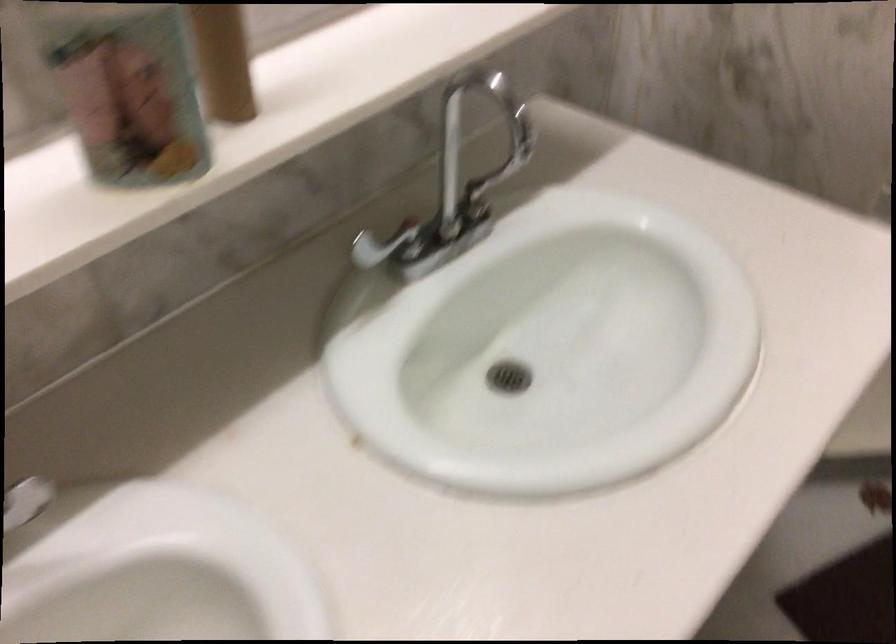
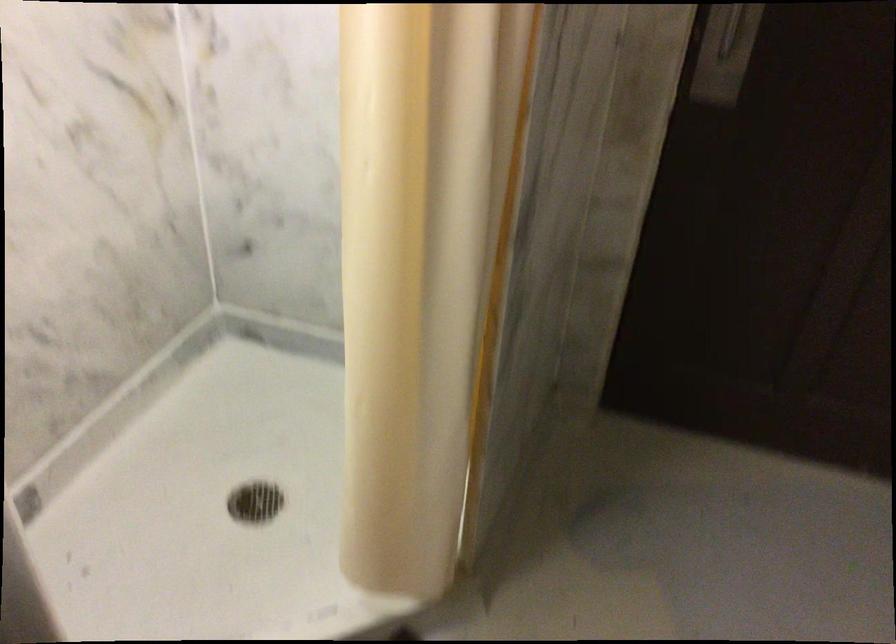
Question: Which direction would the cameraman need to move to produce the second image? Reply with the corresponding letter.

Choices:
 (A) Left
 (B) Right
 (C) Forward
 (D) Backward

Answer: (B)